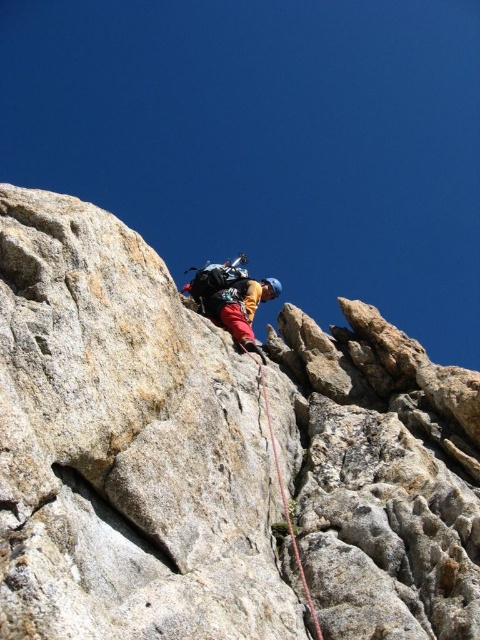
Question: Which of the following is the closest to the observer?

Choices:
 (A) (299, 572)
 (B) (374, 584)

Answer: (B)

Question: Among these objects, which one is farthest from the camera?

Choices:
 (A) gray rock cliff at center
 (B) red nylon rope at center

Answer: (B)

Question: Is gray rock cliff at center further to the viewer compared to red nylon rope at center?

Choices:
 (A) no
 (B) yes

Answer: (A)

Question: Is gray rock cliff at center above red nylon rope at center?

Choices:
 (A) no
 (B) yes

Answer: (B)

Question: Considering the relative positions of gray rock cliff at center and red nylon rope at center in the image provided, where is gray rock cliff at center located with respect to red nylon rope at center?

Choices:
 (A) right
 (B) left

Answer: (A)

Question: Which of the following is the farthest from the observer?

Choices:
 (A) (266, 420)
 (B) (269, 344)

Answer: (B)